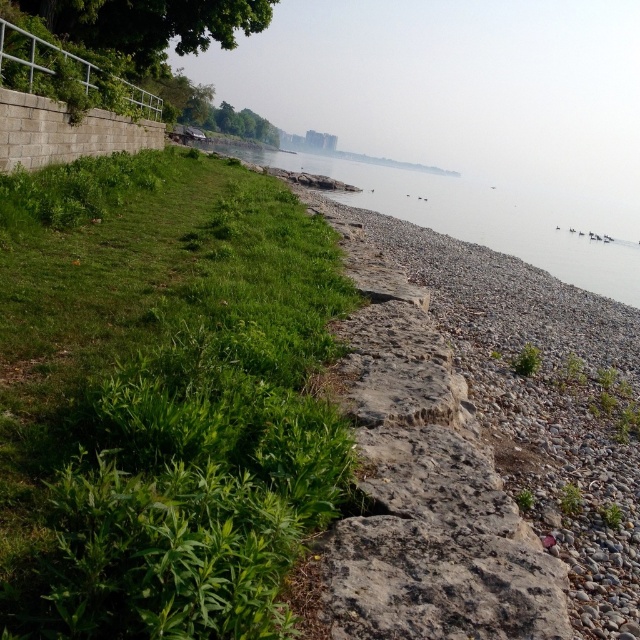
You are standing at the edge of the lakeside scene and want to walk towards the gray gravel water at lower right and the green leafy tree at upper left. Which object will you reach first?

You will reach the gray gravel water at lower right first because it is closer to you than the green leafy tree at upper left, which is further away.

Consider the image. You are standing at the edge of the lakeside scene. You see the gray gravel water at lower right and the green leafy tree at upper left. Which object is positioned higher in the image?

The gray gravel water at lower right is positioned higher than the green leafy tree at upper left in the image.

You are standing at the center of the scene and want to walk towards the gray gravel water at lower right. Which direction should you head relative to the green leafy tree at upper left?

You should head to the right side of the green leafy tree at upper left because the gray gravel water at lower right is positioned on the right side of it.